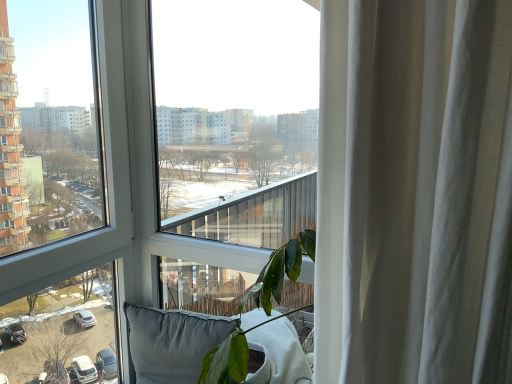
Question: Is transparent glass window at center, which is the second window from left to right, at the left side of gray fabric pillow at lower center?

Choices:
 (A) no
 (B) yes

Answer: (A)

Question: Can you confirm if transparent glass window at center, which is the second window from left to right, is smaller than gray fabric pillow at lower center?

Choices:
 (A) no
 (B) yes

Answer: (A)

Question: From the image's perspective, would you say transparent glass window at center, positioned as the first window in right-to-left order, is positioned over gray fabric pillow at lower center?

Choices:
 (A) yes
 (B) no

Answer: (A)

Question: From a real-world perspective, does transparent glass window at center, which is the second window from left to right, stand above gray fabric pillow at lower center?

Choices:
 (A) yes
 (B) no

Answer: (A)

Question: Is transparent glass window at center, positioned as the first window in right-to-left order, in contact with gray fabric pillow at lower center?

Choices:
 (A) no
 (B) yes

Answer: (A)

Question: Is transparent glass window at center, positioned as the first window in right-to-left order, taller or shorter than gray fabric pillow at lower center?

Choices:
 (A) short
 (B) tall

Answer: (B)

Question: Based on their sizes in the image, would you say transparent glass window at center, positioned as the first window in right-to-left order, is bigger or smaller than gray fabric pillow at lower center?

Choices:
 (A) big
 (B) small

Answer: (A)

Question: From the image's perspective, relative to gray fabric pillow at lower center, is transparent glass window at center, which is the second window from left to right, above or below?

Choices:
 (A) below
 (B) above

Answer: (B)

Question: Considering the positions of point (48, 324) and point (228, 331), is point (48, 324) closer or farther from the camera than point (228, 331)?

Choices:
 (A) farther
 (B) closer

Answer: (A)

Question: Visually, is transparent glass window at center, which is the second window in right-to-left order, positioned to the left or to the right of transparent glass window at center, which is the second window from left to right?

Choices:
 (A) left
 (B) right

Answer: (A)

Question: From their relative heights in the image, would you say transparent glass window at center, which is the second window in right-to-left order, is taller or shorter than transparent glass window at center, positioned as the first window in right-to-left order?

Choices:
 (A) tall
 (B) short

Answer: (A)

Question: Is transparent glass window at center, the first window when ordered from left to right, bigger or smaller than transparent glass window at center, positioned as the first window in right-to-left order?

Choices:
 (A) big
 (B) small

Answer: (B)

Question: Is point (94, 284) positioned closer to the camera than point (36, 182)?

Choices:
 (A) closer
 (B) farther

Answer: (A)

Question: Based on their sizes in the image, would you say gray fabric pillow at lower center is bigger or smaller than transparent glass window at center, which is the second window from left to right?

Choices:
 (A) big
 (B) small

Answer: (B)

Question: Do you think gray fabric pillow at lower center is within transparent glass window at center, which is the second window from left to right, or outside of it?

Choices:
 (A) outside
 (B) inside

Answer: (A)